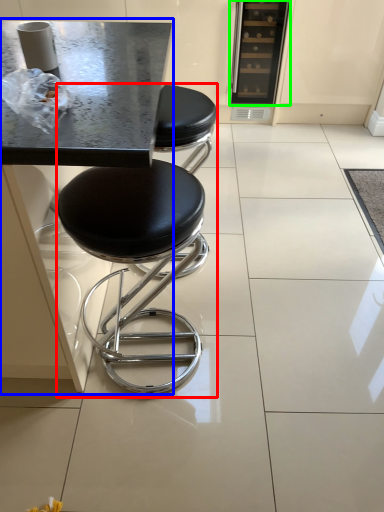
Question: Which object is the farthest from stool (highlighted by a red box)? Choose among these: round table (highlighted by a blue box) or appliance (highlighted by a green box).

Choices:
 (A) round table
 (B) appliance

Answer: (B)